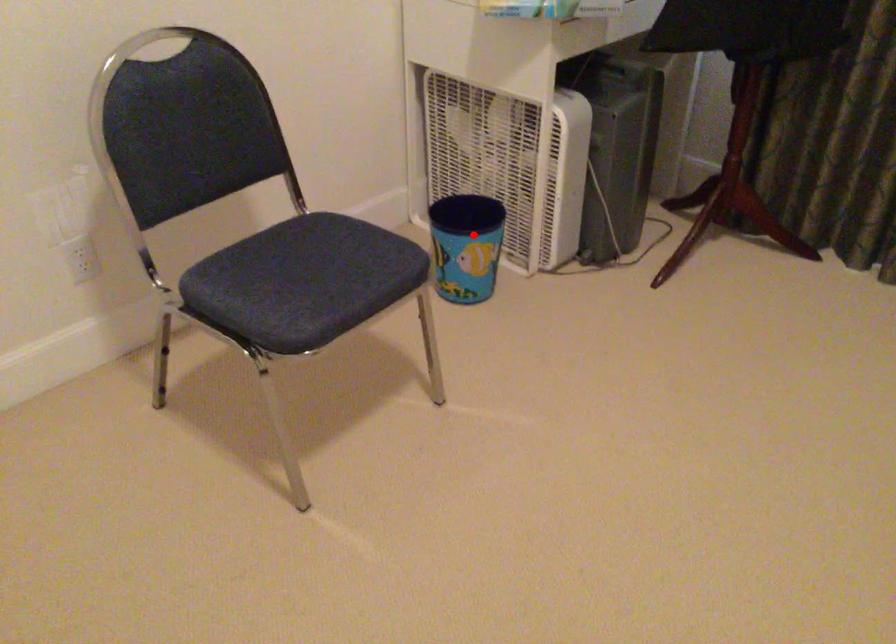
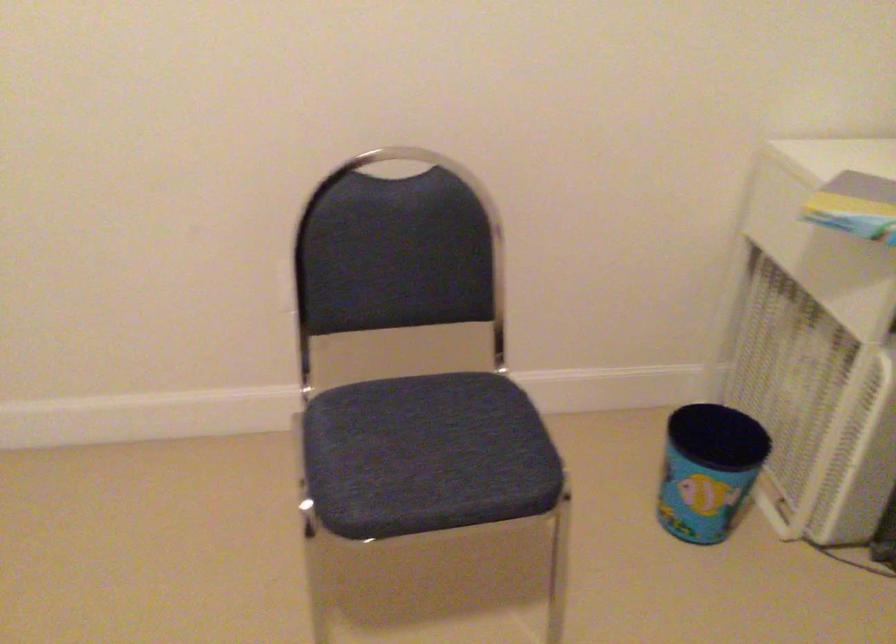
Question: A red point is marked in image1. In image2, is the corresponding 3D point closer to the camera or farther? Reply with the corresponding letter.

Choices:
 (A) The corresponding 3D point is closer.
 (B) The corresponding 3D point is farther.

Answer: (A)